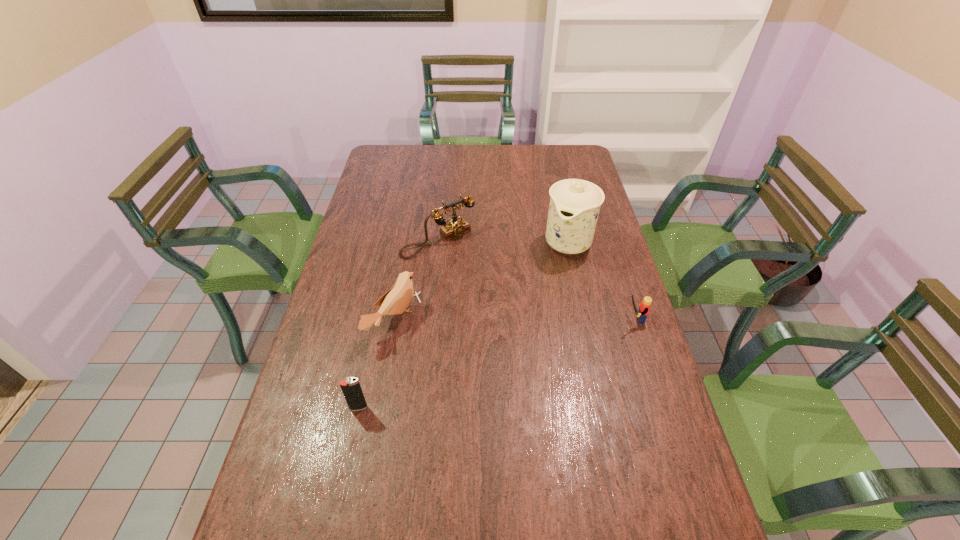
You are a GUI agent. You are given a task and a screenshot of the screen. Output one action in this format:
    pyautogui.click(x=<x>, y=<y>)
    Task: Click on the bird located in the left edge section of the desktop
    
    Given the screenshot: What is the action you would take?
    pyautogui.click(x=395, y=301)

You are a GUI agent. You are given a task and a screenshot of the screen. Output one action in this format:
    pyautogui.click(x=<x>, y=<y>)
    Task: Click on the Lego positioned at the right edge
    
    Given the screenshot: What is the action you would take?
    pyautogui.click(x=644, y=308)

Locate an element on the screen. chinaware at the right edge is located at coordinates (574, 207).

Image resolution: width=960 pixels, height=540 pixels. I want to click on free space at the far edge of the desktop, so click(x=544, y=150).

In order to click on vacant space at the near edge of the desktop in this screenshot , I will do `click(460, 519)`.

Find the location of a particular element. free space at the left edge of the desktop is located at coordinates (378, 193).

The width and height of the screenshot is (960, 540). In order to click on free space at the right edge of the desktop in this screenshot , I will do `click(575, 176)`.

The image size is (960, 540). I want to click on vacant space at the far left corner of the desktop, so click(x=398, y=158).

In the image, there is a desktop. At what (x,y) coordinates should I click in order to perform the action: click on vacant area at the far right corner. Please return your answer as a coordinate pair (x, y). Image resolution: width=960 pixels, height=540 pixels. Looking at the image, I should click on (552, 163).

Find the location of `vacant space in between the chinaware and the rightmost object`. vacant space in between the chinaware and the rightmost object is located at coordinates (600, 280).